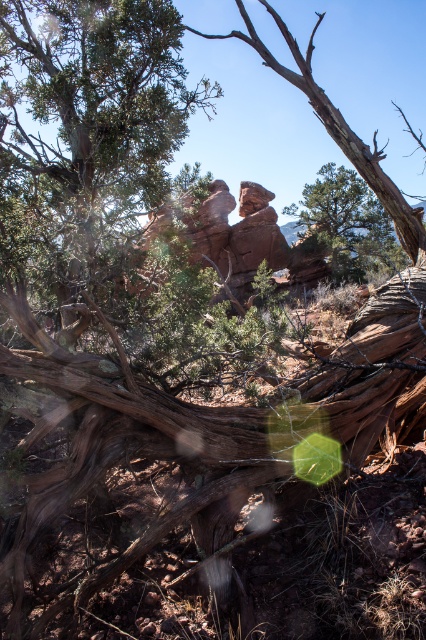
You are a hiker trying to navigate through the rugged landscape. You need to determine which object takes up more space in the scene to plan your path. Which one is larger between the rustic stone rock formation at center and the green matte tree at center?

The green matte tree at center takes up more space than the rustic stone rock formation at center, so it is the larger object in the scene.